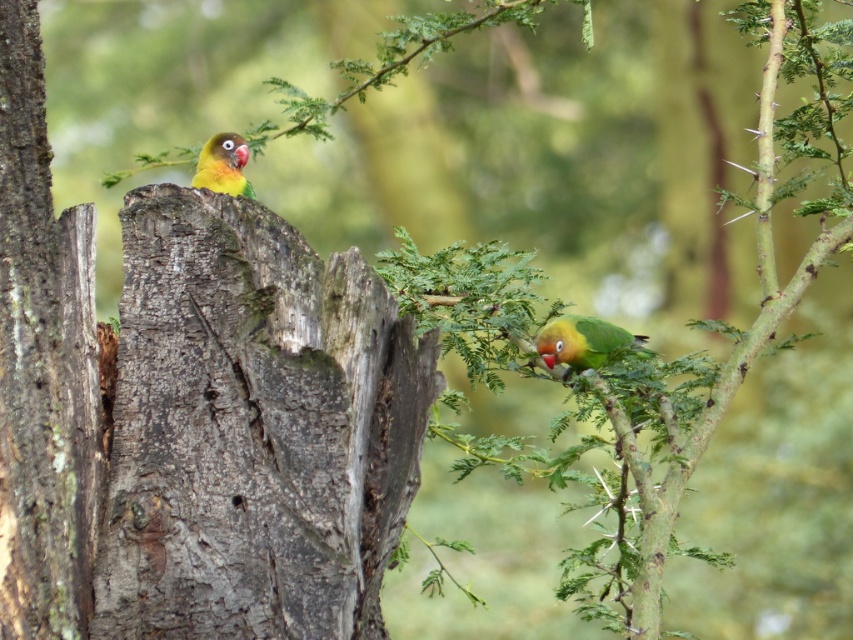
Does gray rough bark tree trunk at left appear over green matte parrot at right?

No, gray rough bark tree trunk at left is not above green matte parrot at right.

Between gray rough bark tree trunk at left and green matte parrot at right, which one has less height?

green matte parrot at right is shorter.

The width and height of the screenshot is (853, 640). Describe the element at coordinates (253, 428) in the screenshot. I see `gray rough bark tree trunk at left` at that location.

Find the location of `gray rough bark tree trunk at left`. gray rough bark tree trunk at left is located at coordinates (253, 428).

Identify the location of rough bark tree trunk at left. This screenshot has height=640, width=853. 44,364.

Who is higher up, rough bark tree trunk at left or green matte parrot at right?

rough bark tree trunk at left

Who is more distant from viewer, (38, 164) or (598, 364)?

The point (598, 364) is behind.

The width and height of the screenshot is (853, 640). I want to click on rough bark tree trunk at left, so click(44, 364).

Is green matte parrot at right to the right of yellow-green parrot at upper left from the viewer's perspective?

Indeed, green matte parrot at right is positioned on the right side of yellow-green parrot at upper left.

Is point (575, 317) more distant than point (231, 179)?

That is True.

Where is `green matte parrot at right`? green matte parrot at right is located at coordinates [584, 342].